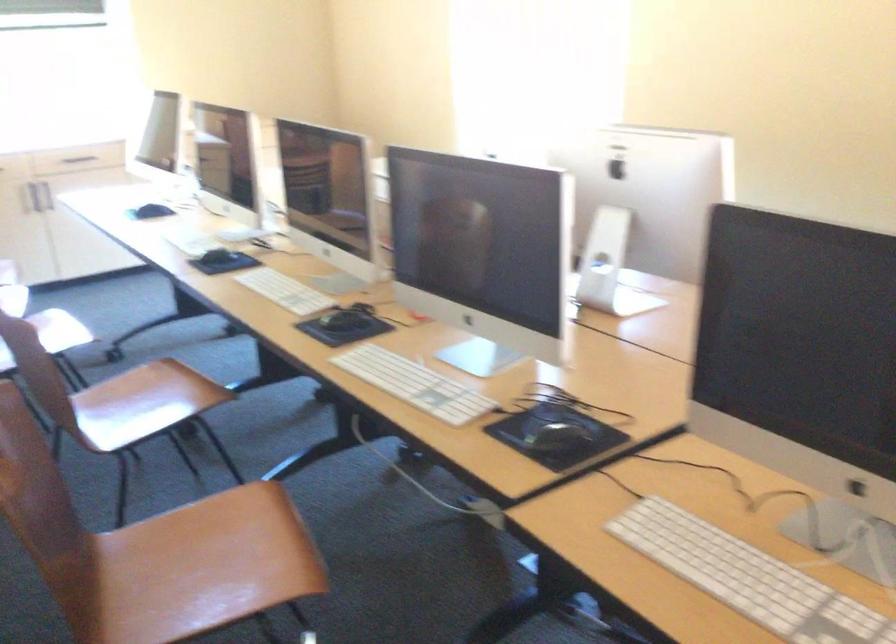
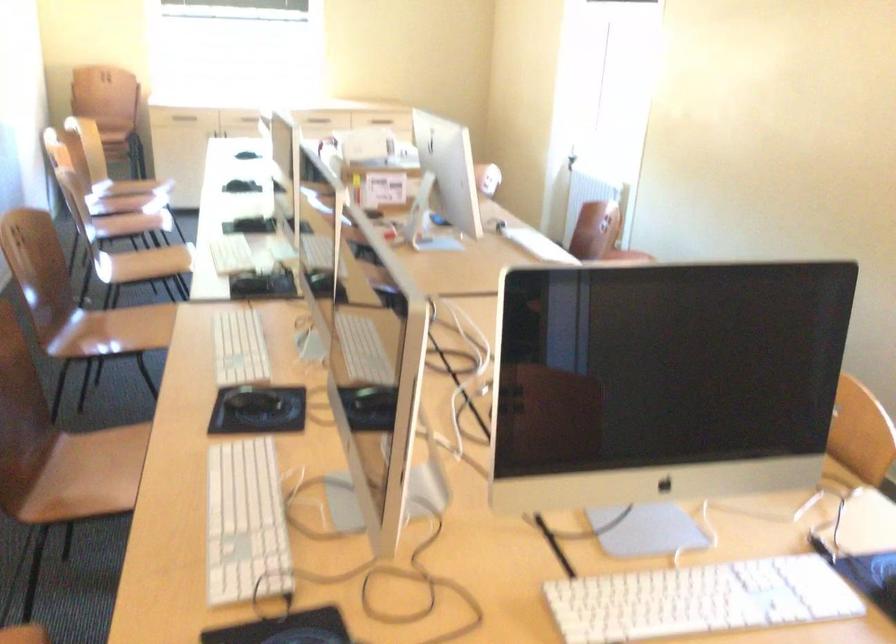
The images are taken continuously from a first-person perspective. In which direction are you moving?

The cameraman moved toward right, backward.